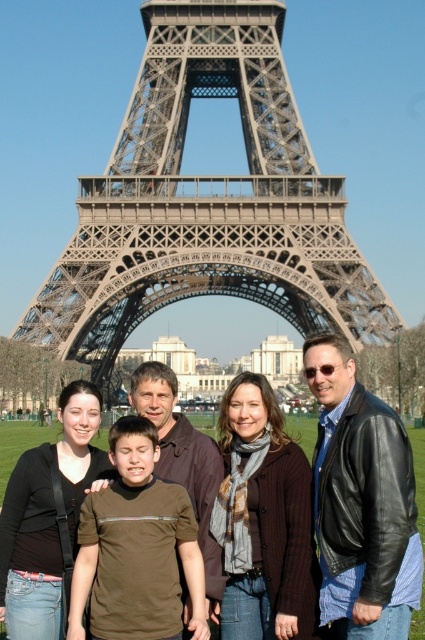
Question: In this image, where is metallic gray eiffel tower at center located relative to brown casual shirt at center?

Choices:
 (A) below
 (B) above

Answer: (B)

Question: Can you confirm if metallic gray eiffel tower at center is positioned to the left of brown casual shirt at center?

Choices:
 (A) no
 (B) yes

Answer: (B)

Question: Is metallic gray eiffel tower at center above brown casual shirt at center?

Choices:
 (A) no
 (B) yes

Answer: (B)

Question: Among these points, which one is farthest from the camera?

Choices:
 (A) (178, 12)
 (B) (404, 387)

Answer: (A)